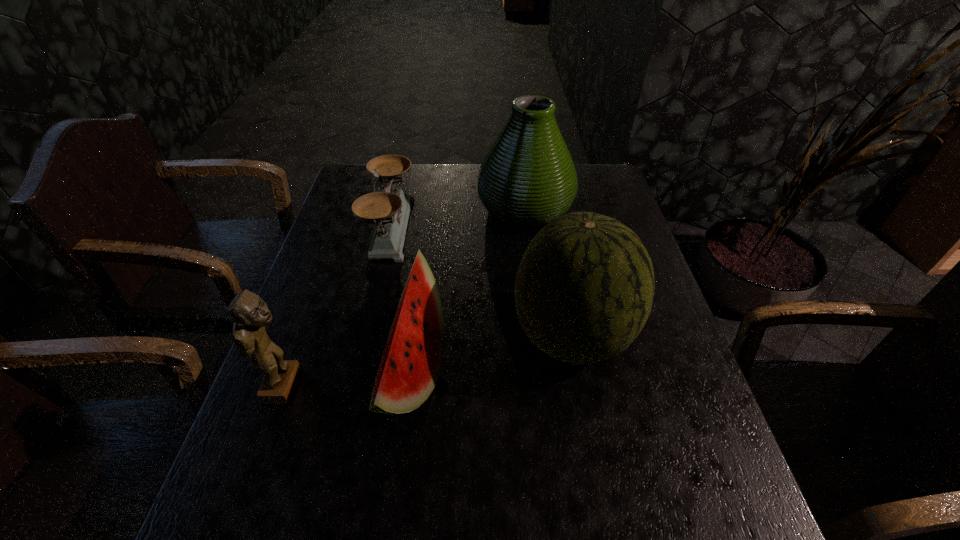
Locate an element on the screen. The height and width of the screenshot is (540, 960). free point at the right edge is located at coordinates (600, 211).

The image size is (960, 540). What are the coordinates of `vacant space at the far left corner of the desktop` in the screenshot? It's located at (352, 182).

Find the location of a particular element. The height and width of the screenshot is (540, 960). vacant point at the near left corner is located at coordinates (244, 532).

The width and height of the screenshot is (960, 540). Identify the location of vacant area at the far right corner of the desktop. 584,181.

What are the coordinates of `free space that is in between the scale and the taller watermelon` in the screenshot? It's located at (481, 282).

The width and height of the screenshot is (960, 540). What are the coordinates of `free spot between the taller watermelon and the scale` in the screenshot? It's located at (481, 282).

Where is `free spot between the leftmost object and the shorter watermelon`? Image resolution: width=960 pixels, height=540 pixels. free spot between the leftmost object and the shorter watermelon is located at coordinates (348, 377).

You are a GUI agent. You are given a task and a screenshot of the screen. Output one action in this format:
    pyautogui.click(x=<x>, y=<y>)
    Task: Click on the free space between the figurine and the scale
    This screenshot has width=960, height=540.
    Given the screenshot: What is the action you would take?
    pyautogui.click(x=338, y=307)

The image size is (960, 540). I want to click on blank region between the right watermelon and the scale, so click(x=481, y=282).

Image resolution: width=960 pixels, height=540 pixels. Find the location of `empty space between the vase and the shorter watermelon`. empty space between the vase and the shorter watermelon is located at coordinates (468, 289).